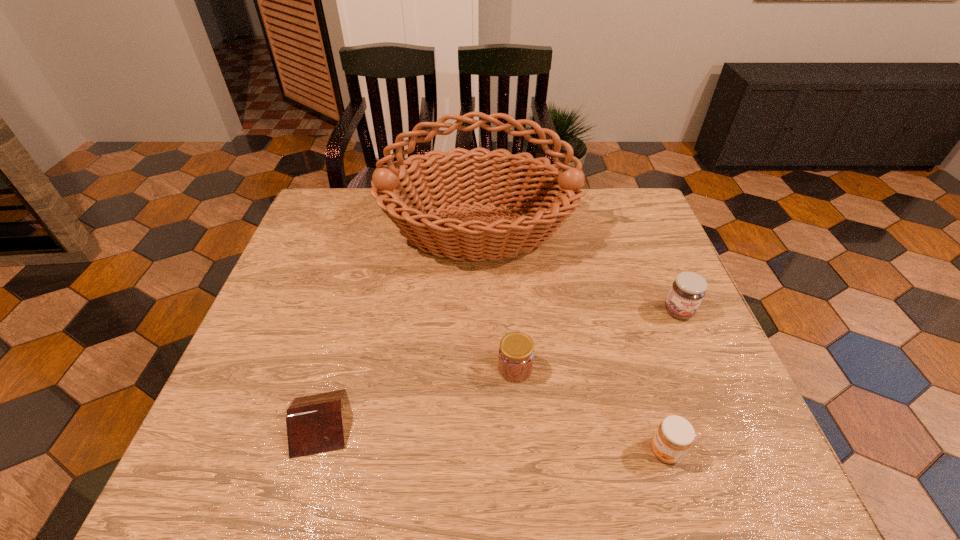
Identify the location of jam object that ranks as the closest to the nearest jam. (516, 352).

Identify the location of vacant space that satisfies the following two spatial constraints: 1. on the front label of the farthest jam; 2. on the front label of the nearest jam. The image size is (960, 540). (738, 451).

You are a GUI agent. You are given a task and a screenshot of the screen. Output one action in this format:
    pyautogui.click(x=<x>, y=<y>)
    Task: Click on the free space that satisfies the following two spatial constraints: 1. on the front label of the rightmost jam; 2. on the front label of the fourth object from left to right
    The width and height of the screenshot is (960, 540).
    Given the screenshot: What is the action you would take?
    pyautogui.click(x=738, y=451)

Find the location of a particular element. vacant position in the image that satisfies the following two spatial constraints: 1. on the back side of the shortest object; 2. on the right side of the tallest object is located at coordinates (373, 231).